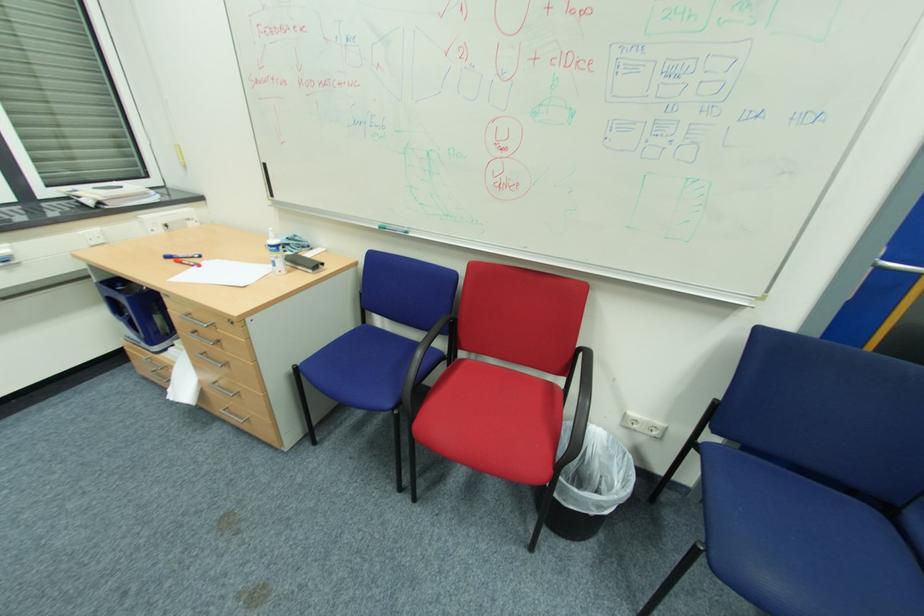
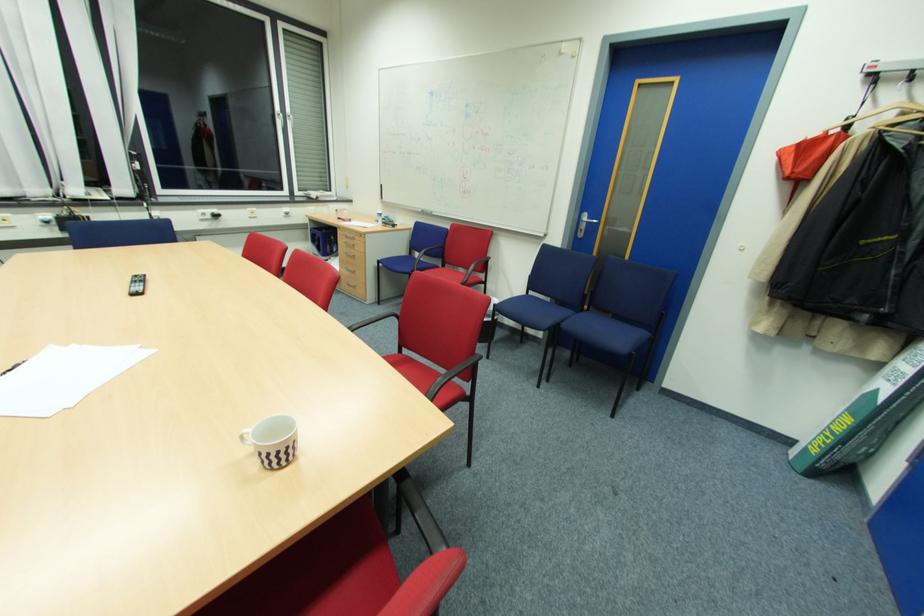
In a continuous first-person perspective shot, in which direction is the camera moving?

The cameraman walked toward right, backward.